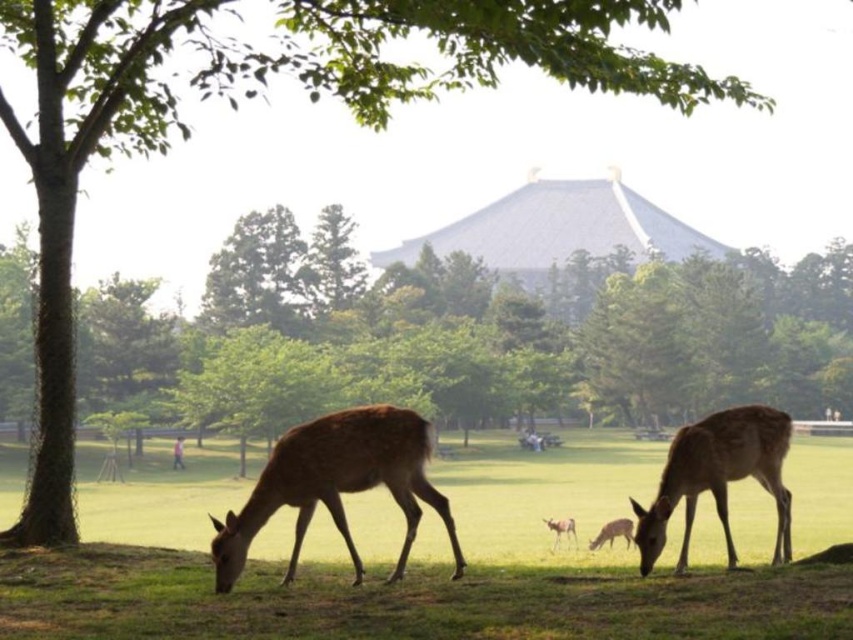
Who is higher up, green grassy at lower center or brown velvet deer at lower right?

brown velvet deer at lower right is above.

Is green grassy at lower center thinner than brown velvet deer at lower right?

No.

Identify the location of green grassy at lower center. (425, 563).

Does brown velvet deer at lower right appear on the left side of brown velvet deer at center?

In fact, brown velvet deer at lower right is to the right of brown velvet deer at center.

Locate an element on the screen. The width and height of the screenshot is (853, 640). brown velvet deer at lower right is located at coordinates (718, 477).

Is point (418, 444) behind point (732, 452)?

No, (418, 444) is in front of (732, 452).

Is brown matte/deer at lower left smaller than brown velvet deer at lower right?

Yes.

Does point (376, 444) lie in front of point (675, 481)?

That is True.

Identify the location of brown matte/deer at lower left. This screenshot has width=853, height=640. (335, 484).